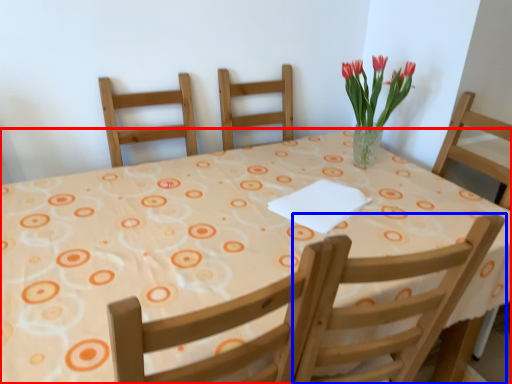
Question: Which of the following is the farthest to the observer, table (highlighted by a red box) or chair (highlighted by a blue box)?

Choices:
 (A) table
 (B) chair

Answer: (B)